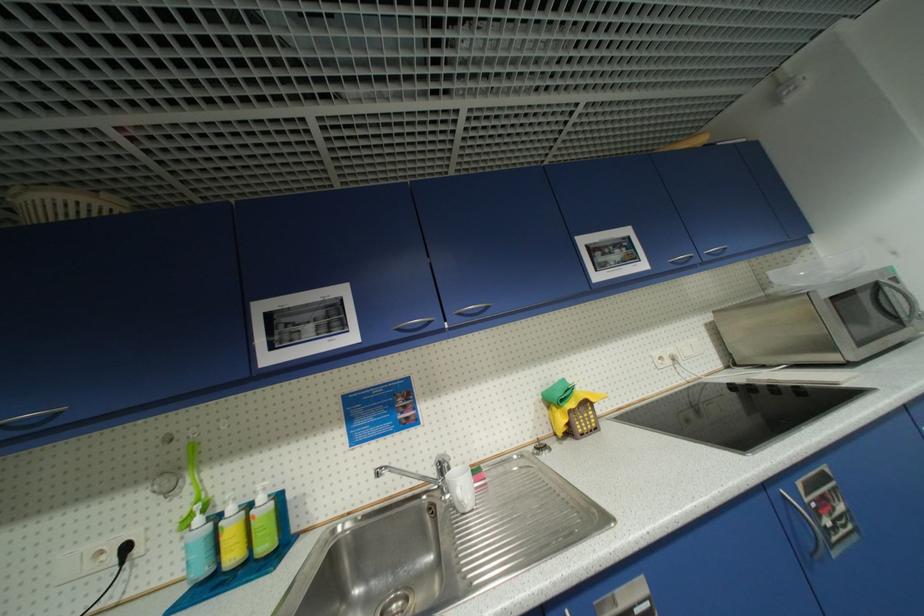
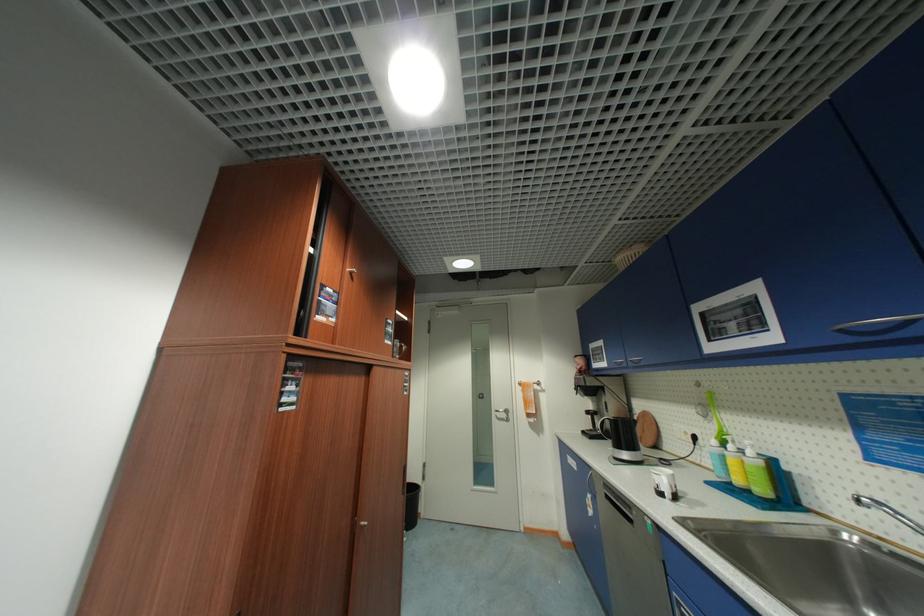
Locate, in the second image, the point that corresponds to pixel 239 559 in the first image.

(744, 482)